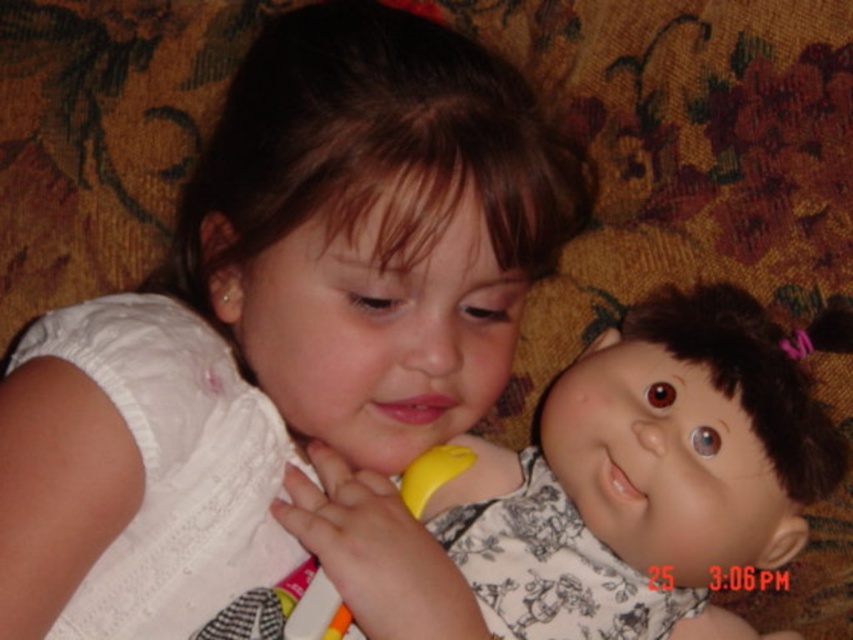
Question: Which of the following is the farthest from the observer?

Choices:
 (A) (757, 449)
 (B) (337, 216)

Answer: (A)

Question: Which of the following is the closest to the observer?

Choices:
 (A) (753, 474)
 (B) (399, 166)

Answer: (B)

Question: Which point is closer to the camera taking this photo?

Choices:
 (A) (694, 488)
 (B) (515, 259)

Answer: (B)

Question: Can you confirm if white fabric dress at center is wider than smooth plastic doll at center?

Choices:
 (A) no
 (B) yes

Answer: (A)

Question: Can you confirm if white fabric dress at center is wider than smooth plastic doll at center?

Choices:
 (A) yes
 (B) no

Answer: (B)

Question: Is white fabric dress at center smaller than smooth plastic doll at center?

Choices:
 (A) yes
 (B) no

Answer: (B)